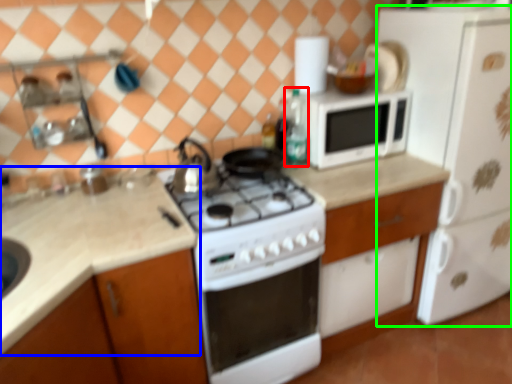
Question: Estimate the real-world distances between objects in this image. Which object is closer to bottle (highlighted by a red box), countertop (highlighted by a blue box) or refrigerator (highlighted by a green box)?

Choices:
 (A) countertop
 (B) refrigerator

Answer: (B)